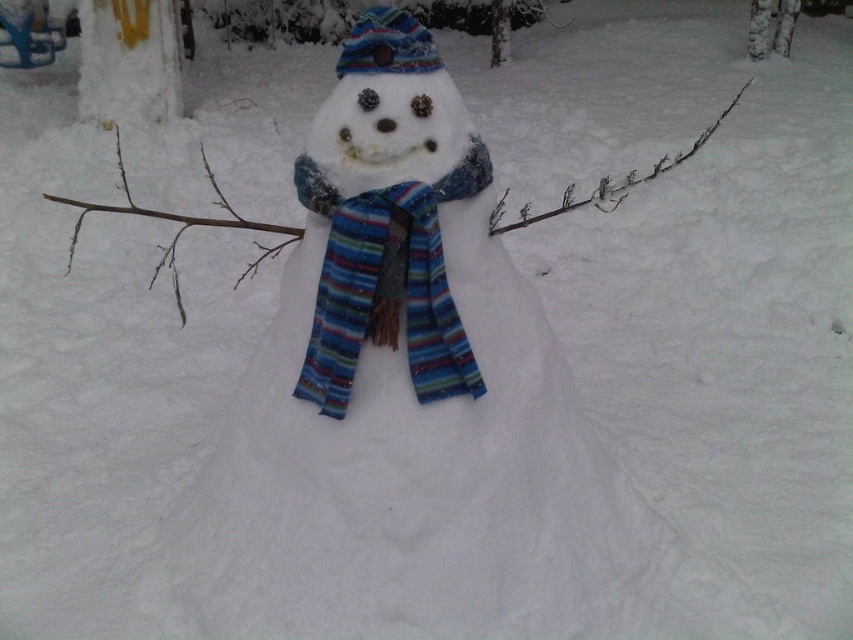
Question: Does striped wool scarf at center appear over striped woolen hat at center?

Choices:
 (A) yes
 (B) no

Answer: (B)

Question: Which point is closer to the camera?

Choices:
 (A) striped woolen hat at center
 (B) striped wool scarf at center

Answer: (B)

Question: Can you confirm if striped wool scarf at center is bigger than striped woolen hat at center?

Choices:
 (A) yes
 (B) no

Answer: (A)

Question: Does striped wool scarf at center have a smaller size compared to striped woolen hat at center?

Choices:
 (A) no
 (B) yes

Answer: (A)

Question: Which object is closer to the camera taking this photo?

Choices:
 (A) striped woolen hat at center
 (B) striped wool scarf at center

Answer: (B)